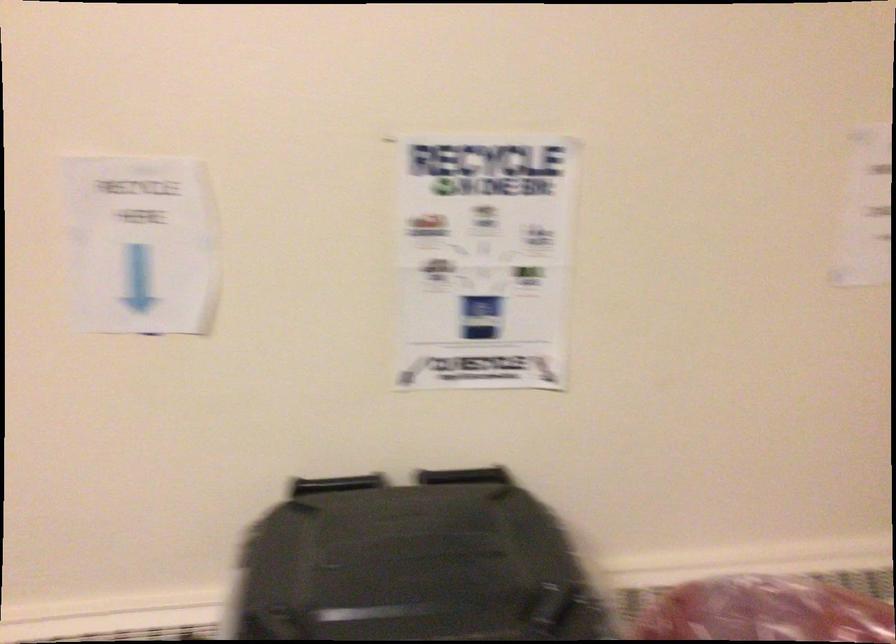
Find where to pull the black bin handle. Please return your answer as a coordinate pair (x, y).

(336, 484)